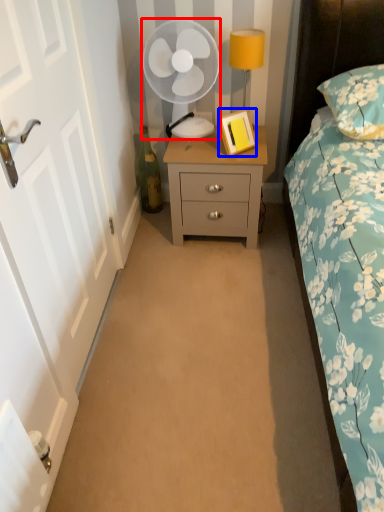
Question: Which of the following is the closest to the observer, mechanical fan (highlighted by a red box) or picture frame (highlighted by a blue box)?

Choices:
 (A) mechanical fan
 (B) picture frame

Answer: (A)